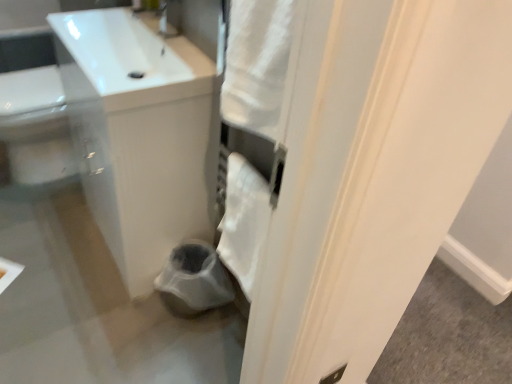
Where is `white soft towel at center`? The width and height of the screenshot is (512, 384). white soft towel at center is located at coordinates (244, 222).

Measure the distance between point (191, 77) and camera.

Point (191, 77) is 1.21 meters away from camera.

This screenshot has width=512, height=384. Find the location of `white glossy sink at upper left`. white glossy sink at upper left is located at coordinates (137, 133).

Measure the distance from white glossy sink at upper left to white glossy sink at upper left.

A distance of 5.65 inches exists between white glossy sink at upper left and white glossy sink at upper left.

Is white glossy sink at upper left positioned with its back to white glossy sink at upper left?

No, white glossy sink at upper left is not facing the opposite direction of white glossy sink at upper left.

Does white glossy sink at upper left have a lesser width compared to white glossy sink at upper left?

Correct, the width of white glossy sink at upper left is less than that of white glossy sink at upper left.

From the picture: From the image's perspective, which one is positioned higher, white glossy sink at upper left or white glossy sink at upper left?

white glossy sink at upper left is shown above in the image.

Who is bigger, white soft towel at center or white glossy sink at upper left?

Bigger between the two is white glossy sink at upper left.

What's the angular difference between white soft towel at center and white glossy sink at upper left's facing directions?

There is a 1.89-degree angle between the facing directions of white soft towel at center and white glossy sink at upper left.

Considering the relative sizes of white soft towel at center and white glossy sink at upper left in the image provided, is white soft towel at center wider than white glossy sink at upper left?

No, white soft towel at center is not wider than white glossy sink at upper left.

From the image's perspective, relative to white glossy sink at upper left, is white soft towel at center above or below?

white soft towel at center is situated lower than white glossy sink at upper left in the image.

From the image's perspective, which one is positioned higher, white glossy sink at upper left or white glossy sink at upper left?

From the image's view, white glossy sink at upper left is above.

Is white glossy sink at upper left wider than white glossy sink at upper left?

Indeed, white glossy sink at upper left has a greater width compared to white glossy sink at upper left.

Considering the sizes of white glossy sink at upper left and white glossy sink at upper left in the image, is white glossy sink at upper left bigger or smaller than white glossy sink at upper left?

In the image, white glossy sink at upper left appears to be larger than white glossy sink at upper left.

Is the position of white glossy sink at upper left more distant than that of white soft towel at center?

Yes, white glossy sink at upper left is further from the camera.

Is white glossy sink at upper left positioned with its back to white soft towel at center?

No, white soft towel at center is not at the back of white glossy sink at upper left.

Consider the image. Is white glossy sink at upper left positioned beyond the bounds of white soft towel at center?

Absolutely, white glossy sink at upper left is external to white soft towel at center.

Visually, is white glossy sink at upper left positioned to the left or to the right of white soft towel at center?

In the image, white glossy sink at upper left appears on the left side of white soft towel at center.

Would you say white glossy sink at upper left is outside white soft towel at center?

That's correct, white glossy sink at upper left is outside of white soft towel at center.

From a real-world perspective, which object rests below the other?

From a 3D spatial view, white soft towel at center is below.

Looking at the image, does white glossy sink at upper left seem bigger or smaller compared to white soft towel at center?

Clearly, white glossy sink at upper left is larger in size than white soft towel at center.

Who is more distant, white glossy sink at upper left or white soft towel at center?

white soft towel at center is further away from the camera.

From the image's perspective, is white soft towel at center positioned above or below white glossy sink at upper left?

Based on their image positions, white soft towel at center is located beneath white glossy sink at upper left.

Looking at the image, does white soft towel at center seem bigger or smaller compared to white glossy sink at upper left?

Considering their sizes, white soft towel at center takes up less space than white glossy sink at upper left.

What's the angular difference between white soft towel at center and white glossy sink at upper left's facing directions?

The facing directions of white soft towel at center and white glossy sink at upper left are 2.32 degrees apart.

Could you tell me if white soft towel at center is turned towards white glossy sink at upper left?

No, white soft towel at center is not oriented towards white glossy sink at upper left.

Locate an element on the screen. sink above the white glossy sink at upper left (from the image's perspective) is located at coordinates (117, 50).

Find the location of a particular element. This screenshot has height=384, width=512. bath towel above the white glossy sink at upper left (from a real-world perspective) is located at coordinates (244, 222).

Estimate the real-world distances between objects in this image. Which object is further from white soft towel at center, white glossy sink at upper left or white glossy sink at upper left?

The object further to white soft towel at center is white glossy sink at upper left.

Looking at the image, which one is located further to white soft towel at center, white glossy sink at upper left or white glossy sink at upper left?

Based on the image, white glossy sink at upper left appears to be further to white soft towel at center.

Looking at the image, which one is located closer to white glossy sink at upper left, white glossy sink at upper left or white soft towel at center?

Based on the image, white glossy sink at upper left appears to be nearer to white glossy sink at upper left.

From the image, which object appears to be farther from white glossy sink at upper left, white soft towel at center or white glossy sink at upper left?

white soft towel at center.

From the image, which object appears to be farther from white glossy sink at upper left, white glossy sink at upper left or white soft towel at center?

white soft towel at center.

Which object lies further to the anchor point white glossy sink at upper left, white soft towel at center or white glossy sink at upper left?

Among the two, white soft towel at center is located further to white glossy sink at upper left.

Where is `counter top between white glossy sink at upper left and white soft towel at center in the vertical direction`? This screenshot has width=512, height=384. counter top between white glossy sink at upper left and white soft towel at center in the vertical direction is located at coordinates (137, 133).